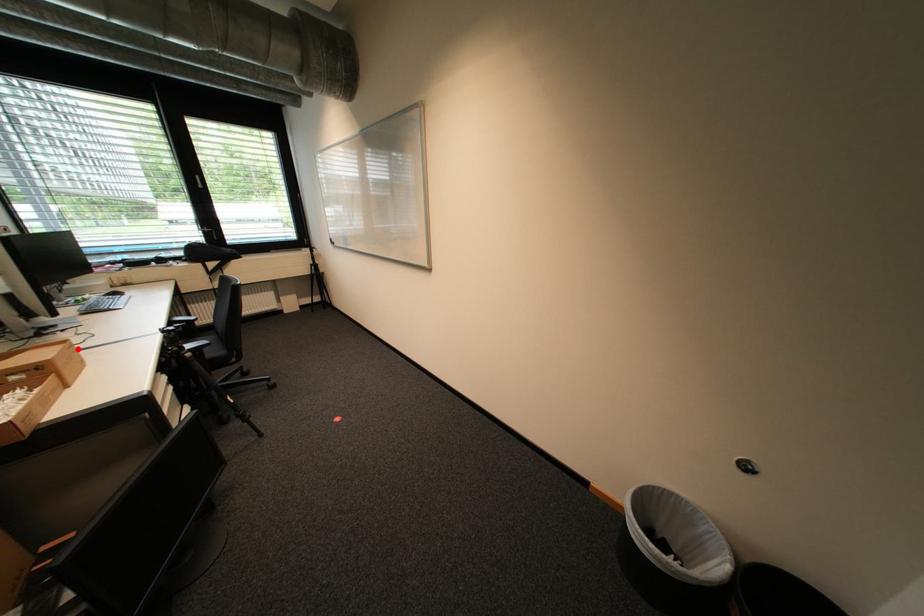
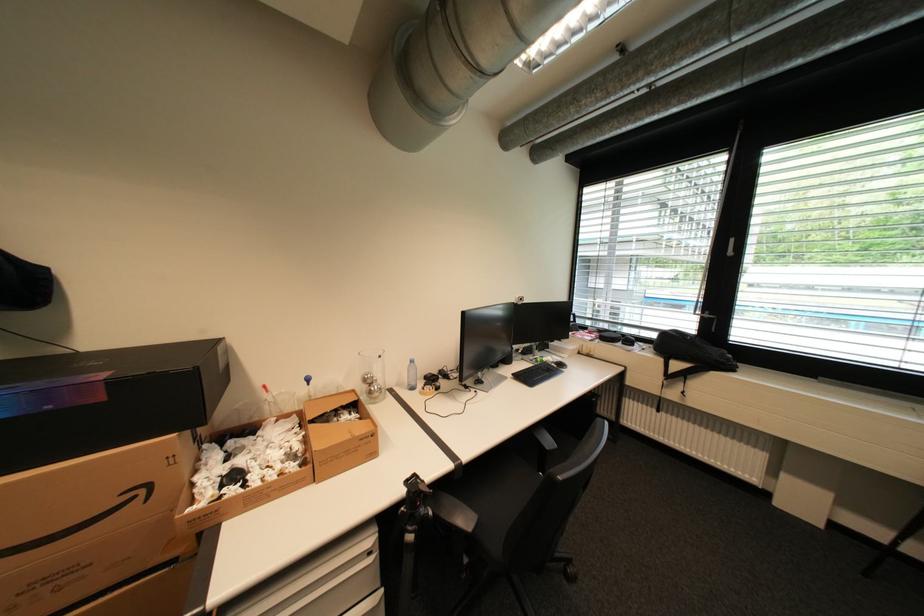
Question: I am providing you with two images of the same scene from different viewpoints. In image1, a red point is highlighted. Considering the same 3D point in image2, which of the following is correct?

Choices:
 (A) It is closer
 (B) It is farther

Answer: (B)